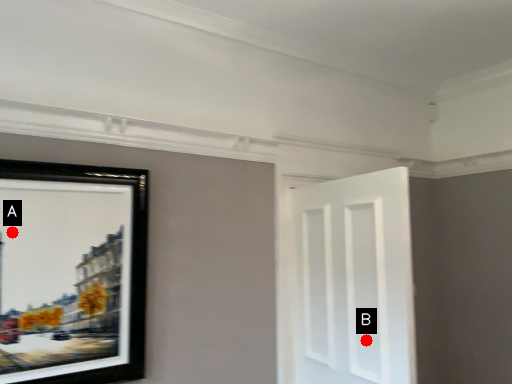
Question: Two points are circled on the image, labeled by A and B beside each circle. Which of the following is the farthest from the observer?

Choices:
 (A) A is further
 (B) B is further

Answer: (B)